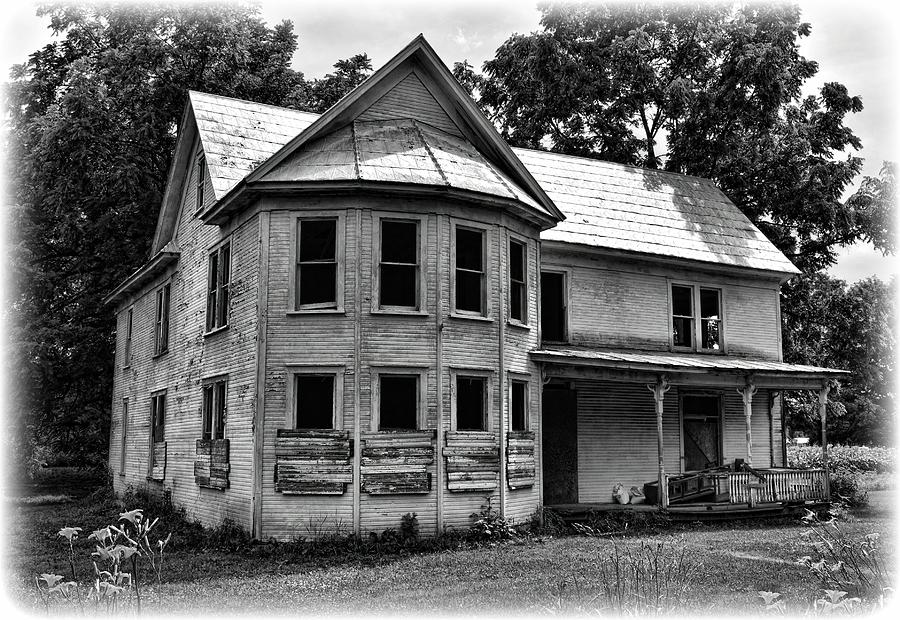
Where is `front door`? front door is located at coordinates (554, 452).